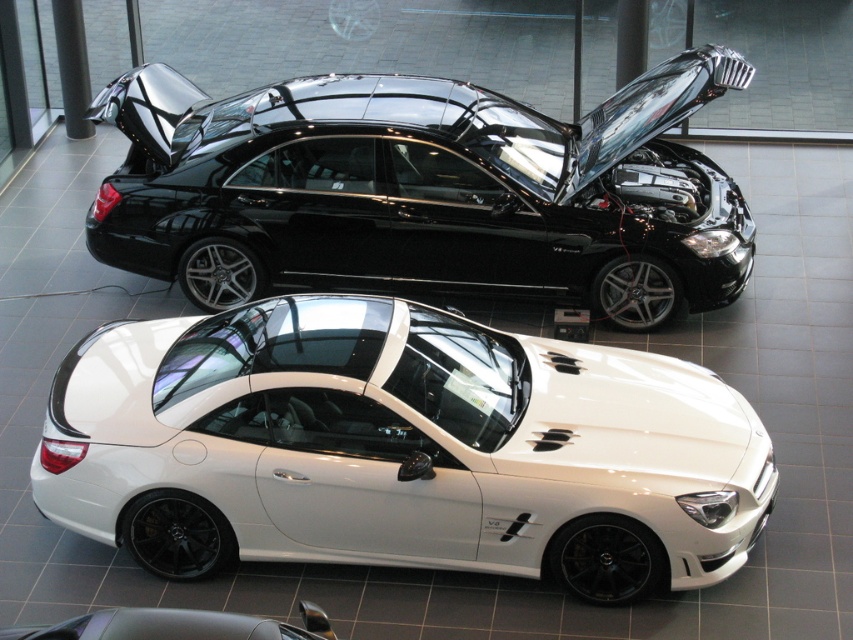
You are standing in a showroom and want to locate the white glossy sedan at center. According to the coordinates, where exactly is it positioned?

The white glossy sedan at center is positioned at coordinates point [399,449].